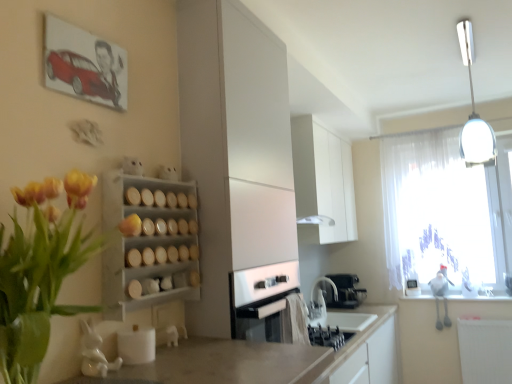
Question: Is yellow tulip bouquet at left wider or thinner than white matte cabinet at center, acting as the 1th cabinetry starting from the front?

Choices:
 (A) thin
 (B) wide

Answer: (A)

Question: Looking at the image, does yellow tulip bouquet at left seem bigger or smaller compared to white matte cabinet at center, positioned as the second cabinetry in right-to-left order?

Choices:
 (A) big
 (B) small

Answer: (B)

Question: Estimate the real-world distances between objects in this image. Which object is closer to the white matte spice rack at center-left?

Choices:
 (A) white matte cabinet at center, positioned as the second cabinetry in right-to-left order
 (B) black matte coffee machine at lower center
 (C) white glossy light fixture at upper right
 (D) transparent fabric at upper right
 (E) yellow tulip bouquet at left

Answer: (E)

Question: Which object is the closest to the yellow tulip bouquet at left?

Choices:
 (A) white matte spice rack at center-left
 (B) black matte coffee machine at lower center
 (C) yellow matte flower at upper left
 (D) transparent fabric at upper right
 (E) white matte cabinet at center, positioned as the second cabinetry in right-to-left order

Answer: (A)